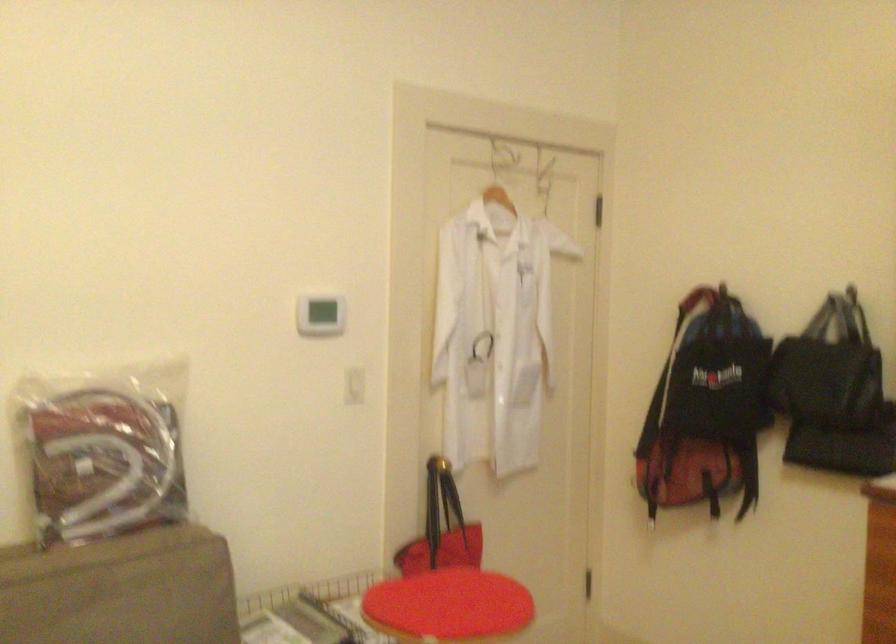
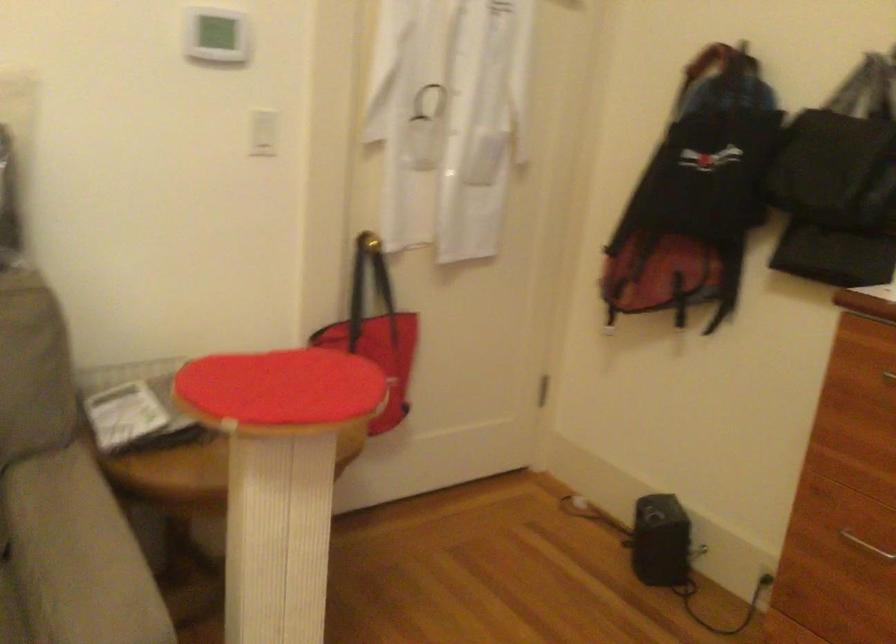
Question: Based on the continuous images, in which direction is the camera rotating? Reply with the corresponding letter.

Choices:
 (A) Left
 (B) Right
 (C) Up
 (D) Down

Answer: (D)